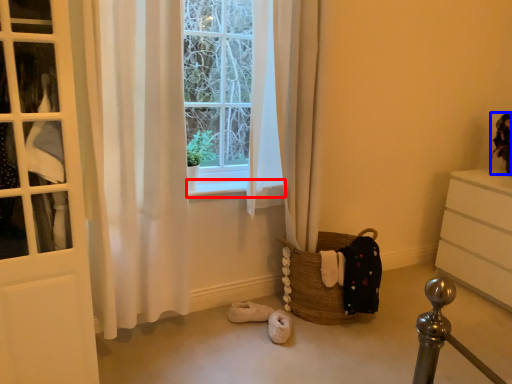
Question: Which object appears farthest to the camera in this image, window sill (highlighted by a red box) or doll (highlighted by a blue box)?

Choices:
 (A) window sill
 (B) doll

Answer: (B)